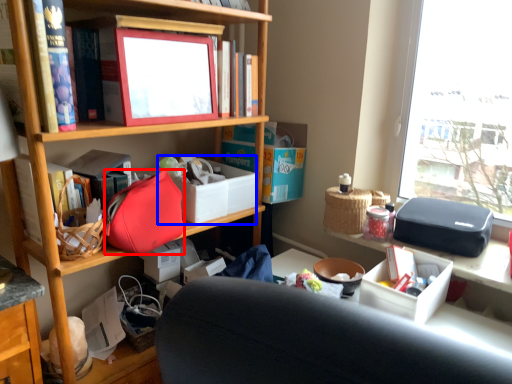
Question: Which of the following is the farthest to the observer, handbag (highlighted by a red box) or storage box (highlighted by a blue box)?

Choices:
 (A) handbag
 (B) storage box

Answer: (B)